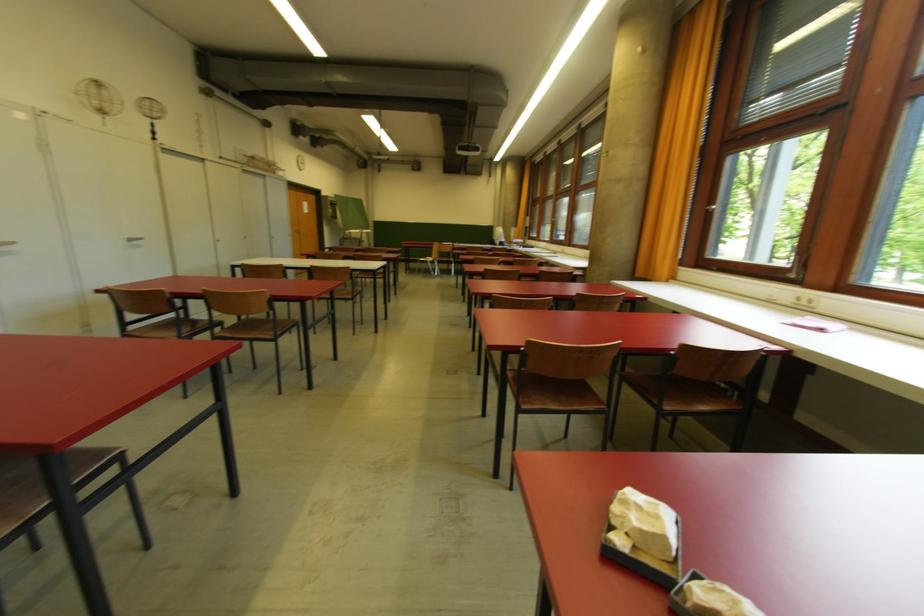
Find where to lift the pink booklet. Please return your answer as a coordinate pair (x, y).

(815, 323)